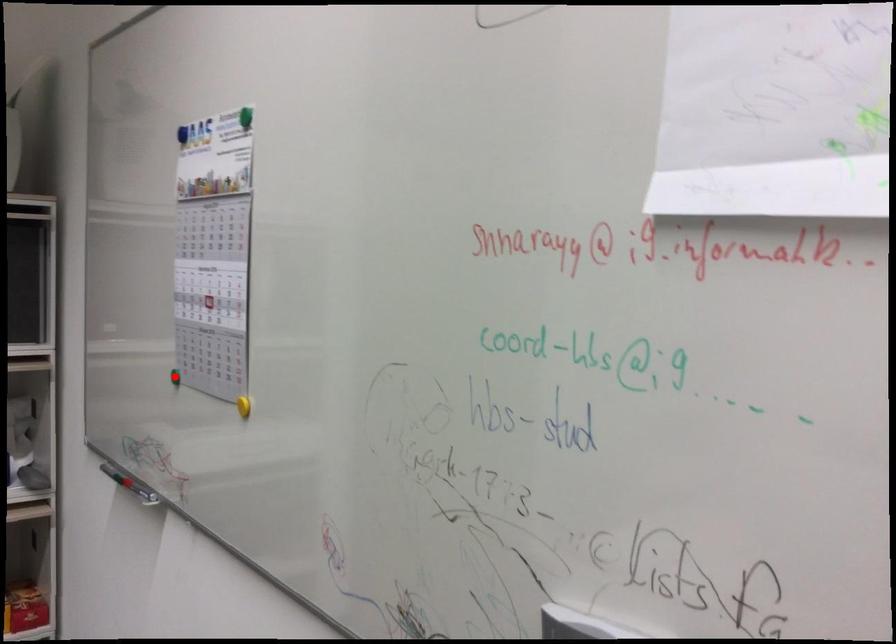
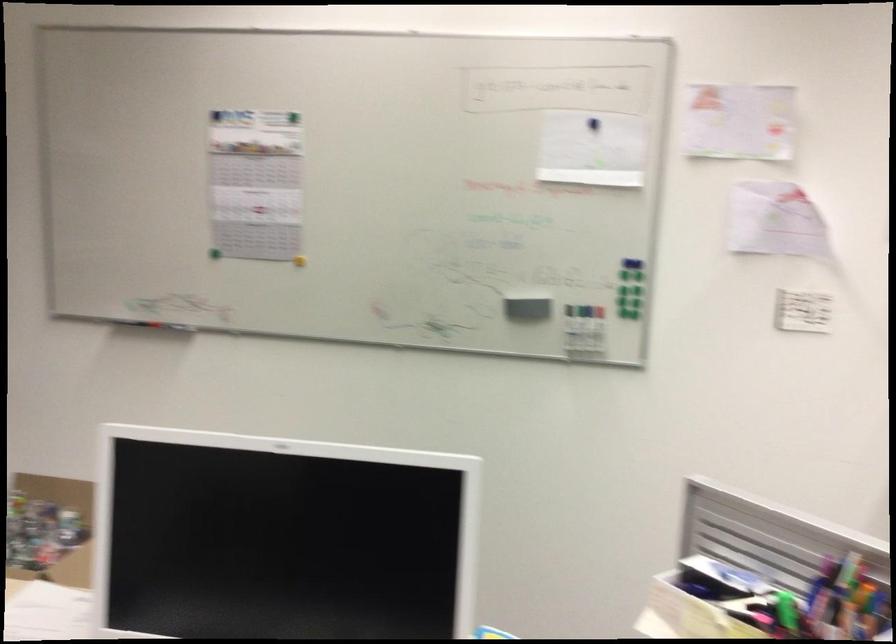
Question: A red point is marked in image1. In image2, is the corresponding 3D point closer to the camera or farther? Reply with the corresponding letter.

Choices:
 (A) The corresponding 3D point is closer.
 (B) The corresponding 3D point is farther.

Answer: (B)